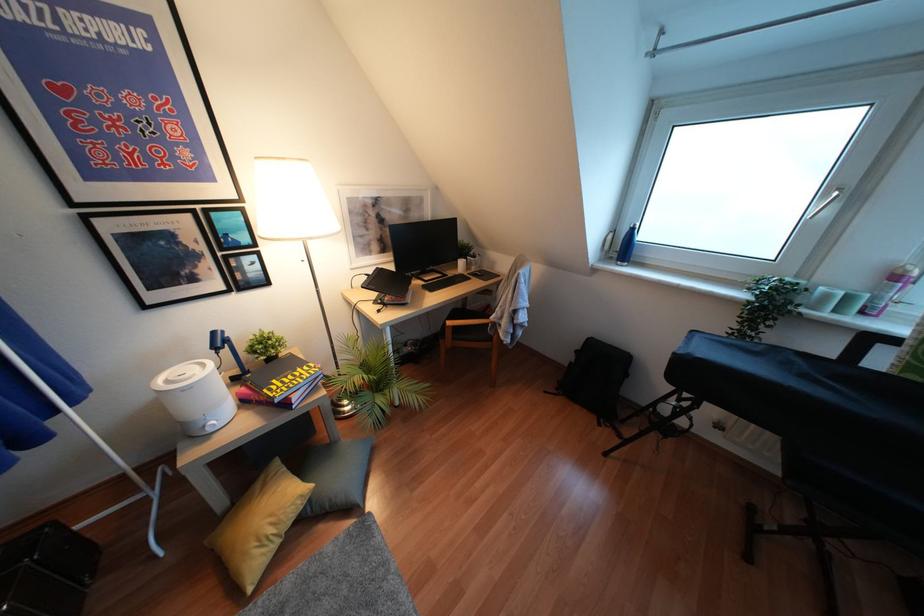
This screenshot has width=924, height=616. I want to click on silver window handle, so click(825, 201).